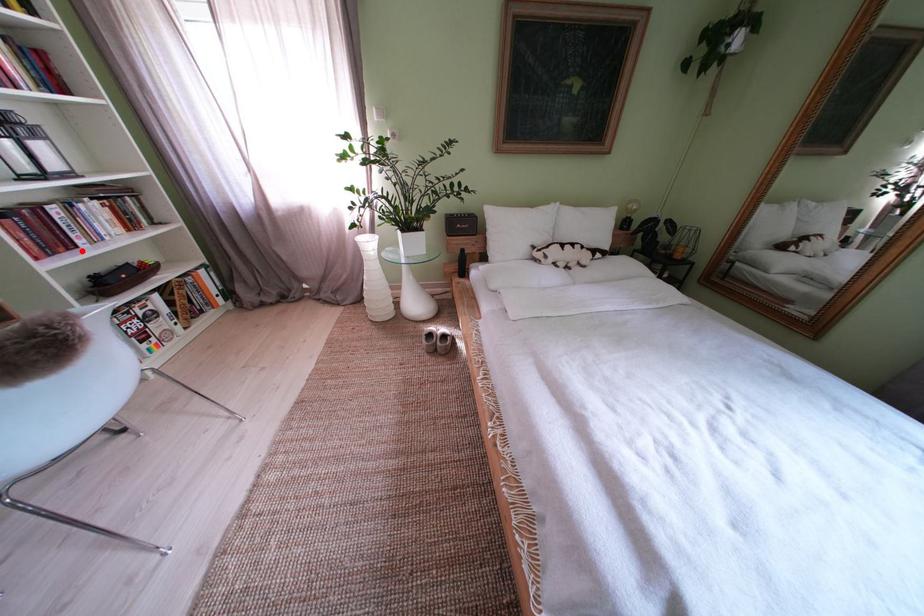
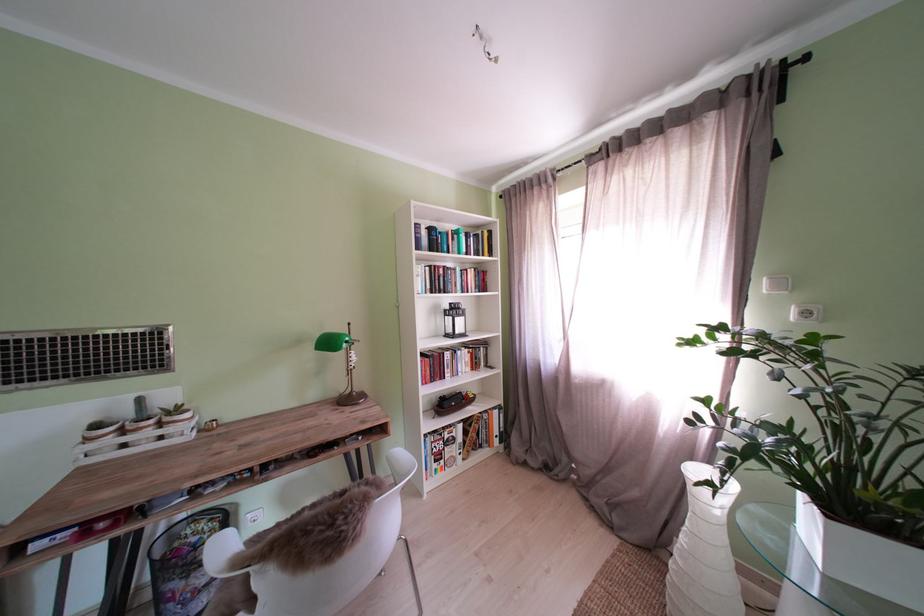
Locate, in the second image, the point that corresponds to the highlighted location in the first image.

(454, 382)